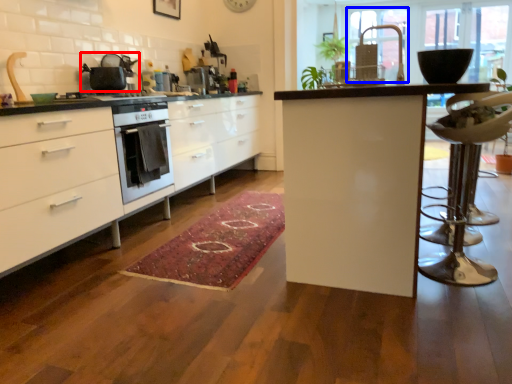
Question: Which point is further to the camera, kitchen appliance (highlighted by a red box) or window screen (highlighted by a blue box)?

Choices:
 (A) kitchen appliance
 (B) window screen

Answer: (A)